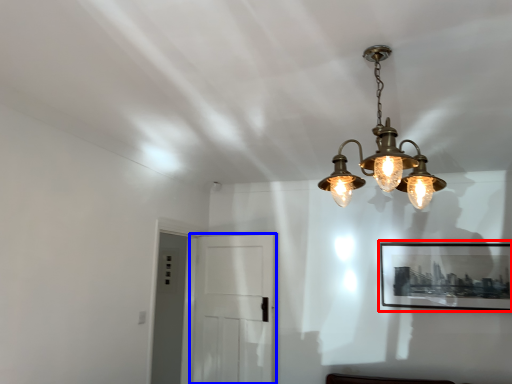
Question: Among these objects, which one is farthest to the camera, picture frame (highlighted by a red box) or glass door (highlighted by a blue box)?

Choices:
 (A) picture frame
 (B) glass door

Answer: (A)